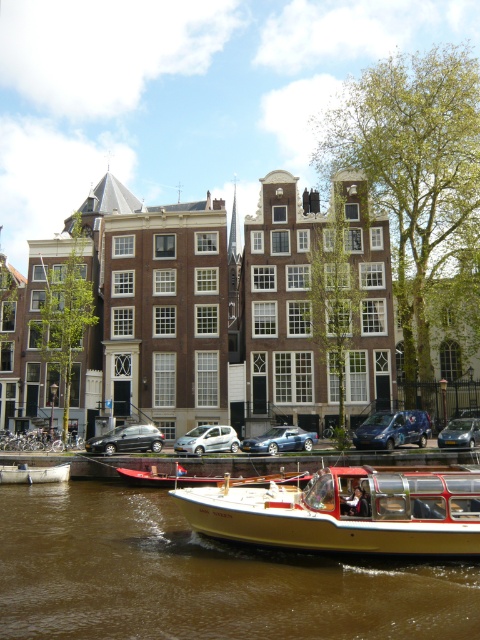
Is brown water at center taller than metallic blue car at center?

Correct, brown water at center is much taller as metallic blue car at center.

Who is taller, brown water at center or metallic blue car at center?

With more height is brown water at center.

Is point (118, 560) behind point (267, 435)?

No, (118, 560) is closer to viewer.

I want to click on brown water at center, so click(203, 577).

In order to click on metallic blue van at center in this screenshot , I will do `click(393, 429)`.

I want to click on metallic blue van at center, so click(393, 429).

What are the coordinates of `metallic blue van at center` in the screenshot? It's located at (393, 429).

Is metallic blue car at center above matte silver car at center?

No, metallic blue car at center is not above matte silver car at center.

Which is behind, point (250, 445) or point (444, 428)?

The point (444, 428) is more distant.

Does point (279, 440) come closer to viewer compared to point (468, 422)?

That is True.

Image resolution: width=480 pixels, height=640 pixels. What are the coordinates of `metallic blue car at center` in the screenshot? It's located at (280, 440).